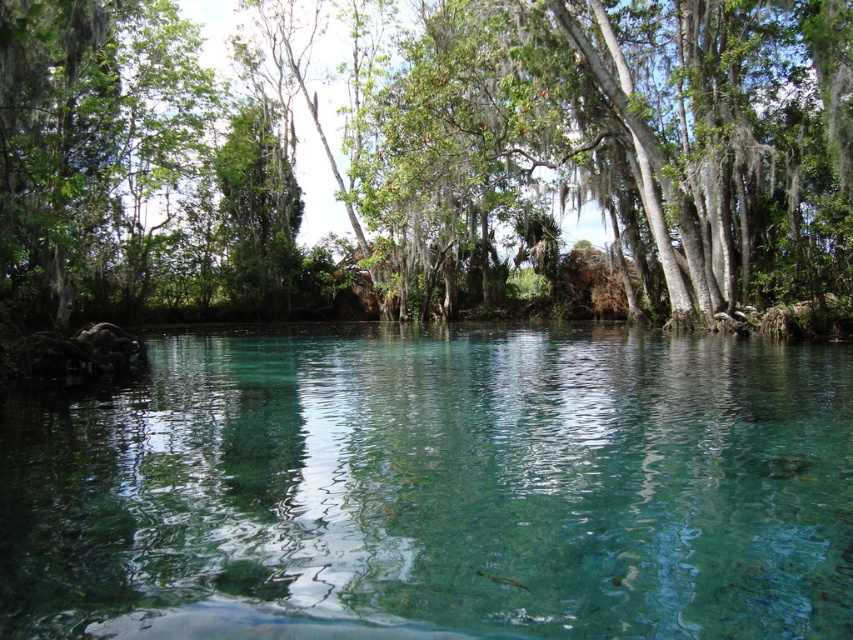
You are standing at the edge of the serene natural scene described. There is a point marked at coordinates (436, 488). Based on the scene description, what object is located at this point?

The point at coordinates (436, 488) corresponds to the clear glass river at center.

You are standing at the edge of the serene natural scene with the turquoise water and dense forest. You see two points marked in the image. Which point, point [9,614] or point [405,252], is closer to you?

Point [9,614] is closer to the viewer than point [405,252].